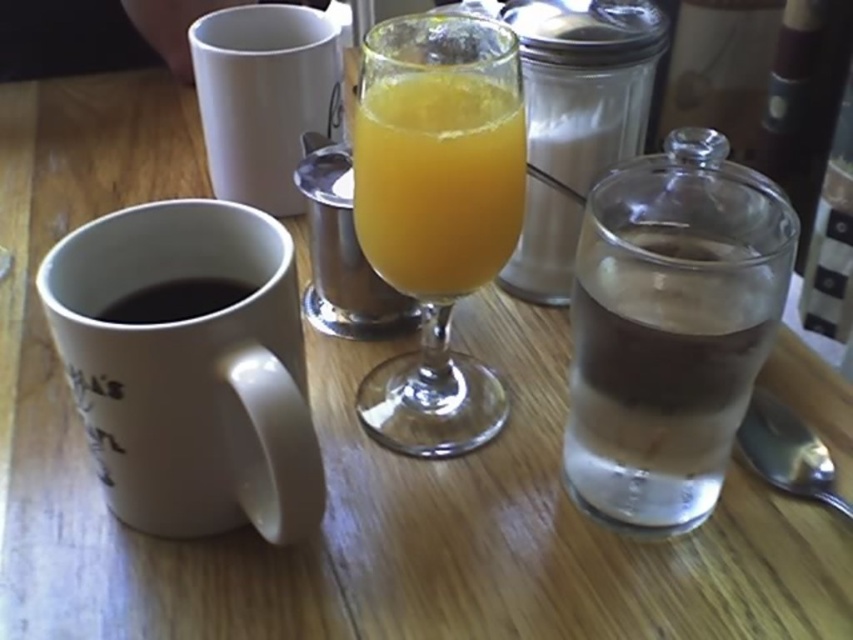
Question: Based on their relative distances, which object is farther from the white matte mug at left?

Choices:
 (A) clear glass water at right
 (B) translucent glass at center
 (C) white matte mug at upper center

Answer: (C)

Question: From the image, what is the correct spatial relationship of white matte mug at left in relation to white matte mug at upper center?

Choices:
 (A) below
 (B) above

Answer: (A)

Question: Which point is farther to the camera?

Choices:
 (A) (213, 12)
 (B) (219, 435)
 (C) (624, 518)
 (D) (212, 305)

Answer: (A)

Question: Is clear glass water at right positioned behind black matte mug at left?

Choices:
 (A) yes
 (B) no

Answer: (B)

Question: Among these objects, which one is nearest to the camera?

Choices:
 (A) white matte mug at left
 (B) black matte mug at left
 (C) clear glass water at right
 (D) white matte mug at upper center

Answer: (A)

Question: Can you confirm if white matte mug at left is positioned to the right of black matte mug at left?

Choices:
 (A) no
 (B) yes

Answer: (B)